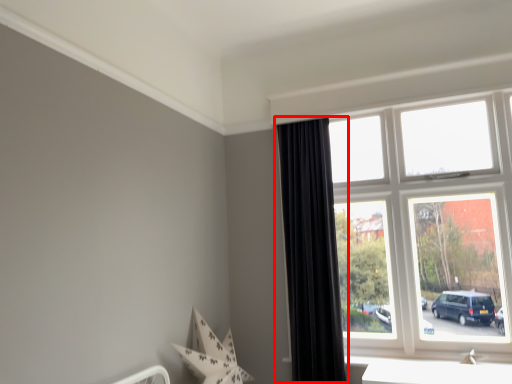
Question: From the image's perspective, where is curtain (annotated by the red box) located relative to window?

Choices:
 (A) below
 (B) above

Answer: (A)